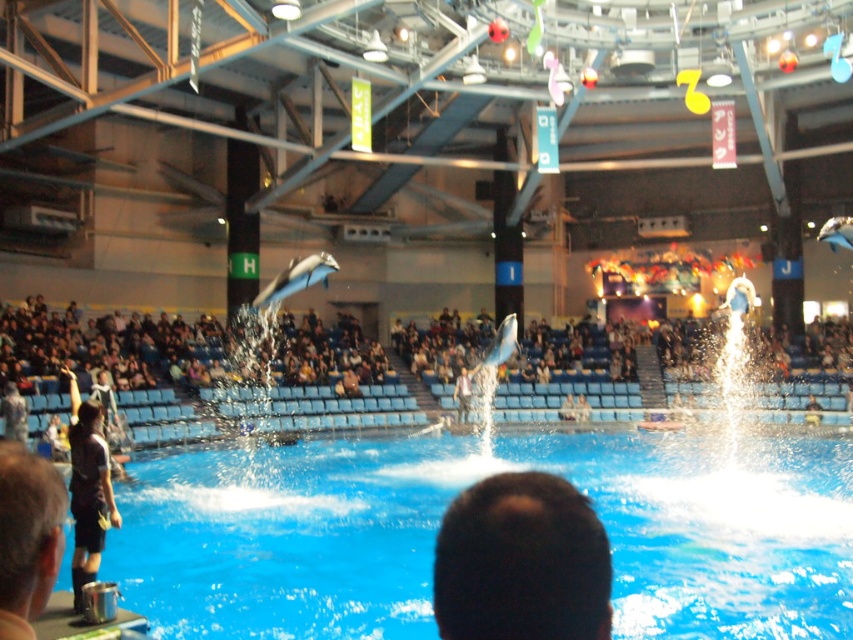
Question: Can you confirm if dark hair at center is positioned above dark brown leather jacket at lower left?

Choices:
 (A) yes
 (B) no

Answer: (A)

Question: Which point is farther to the camera?

Choices:
 (A) (485, 486)
 (B) (33, 588)

Answer: (B)

Question: Is dark hair at center thinner than dark brown leather jacket at lower left?

Choices:
 (A) no
 (B) yes

Answer: (A)

Question: Among these points, which one is nearest to the camera?

Choices:
 (A) (508, 616)
 (B) (32, 570)

Answer: (A)

Question: Which of the following is the closest to the observer?

Choices:
 (A) (570, 604)
 (B) (3, 563)
 (C) (386, 472)

Answer: (A)

Question: Does dark hair at center have a greater width compared to dark brown leather jacket at lower left?

Choices:
 (A) yes
 (B) no

Answer: (A)